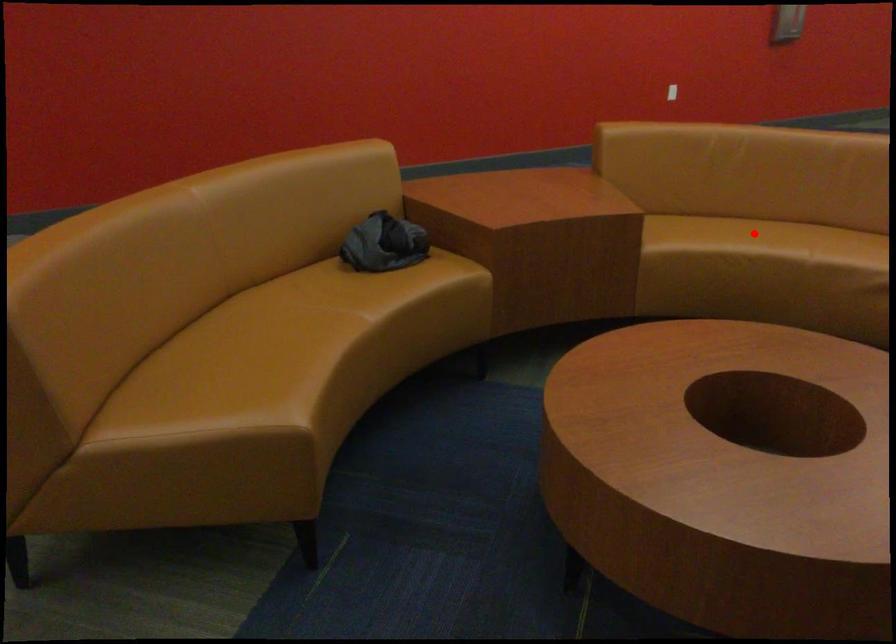
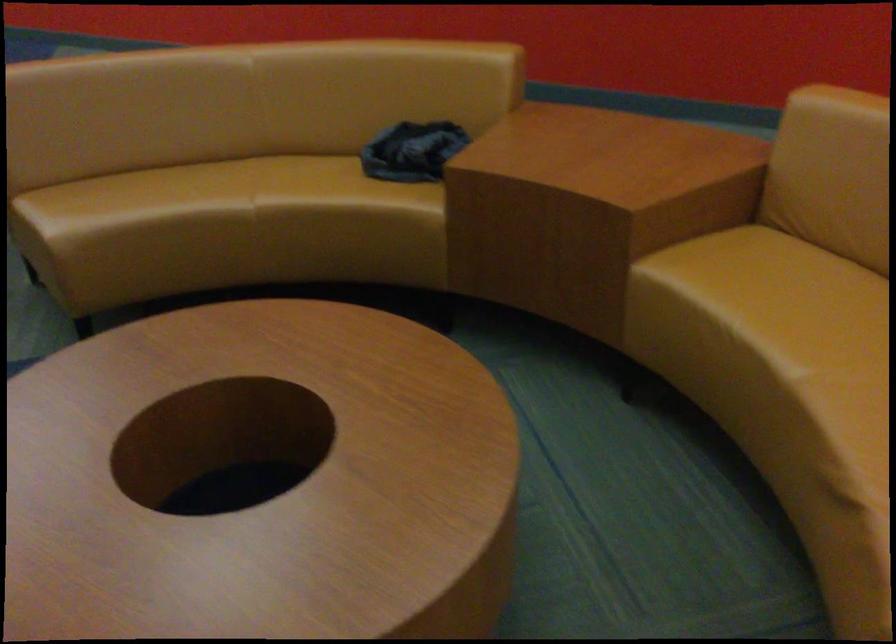
Question: I am providing you with two images of the same scene from different viewpoints. Given a red point in image1, look at the same physical point in image2. Is it:

Choices:
 (A) Closer to the viewpoint
 (B) Farther from the viewpoint

Answer: (A)